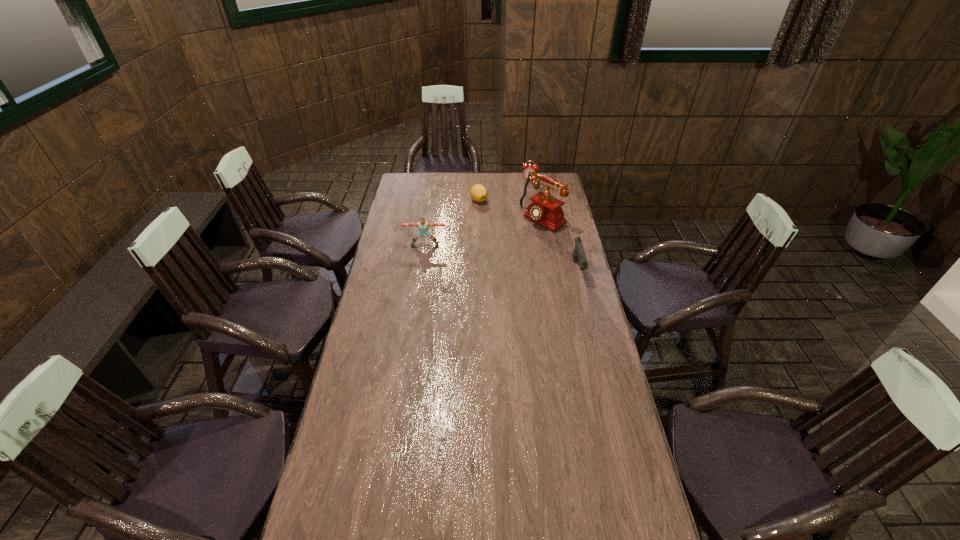
Find the location of a particular element. This screenshot has height=540, width=960. puncher is located at coordinates coord(423,225).

The image size is (960, 540). What are the coordinates of `the leftmost object` in the screenshot? It's located at (423, 225).

Find the location of a particular element. the nearest object is located at coordinates (578, 254).

This screenshot has height=540, width=960. In order to click on lemon in this screenshot , I will do `click(478, 192)`.

You are a GUI agent. You are given a task and a screenshot of the screen. Output one action in this format:
    pyautogui.click(x=<x>, y=<y>)
    Task: Click on the second object from left to right
    Image resolution: width=960 pixels, height=540 pixels.
    Given the screenshot: What is the action you would take?
    click(478, 192)

Where is `the farthest object`? the farthest object is located at coordinates (527, 168).

Where is `the tallest object`? The width and height of the screenshot is (960, 540). the tallest object is located at coordinates (546, 210).

Find the location of `telephone`. telephone is located at coordinates (546, 210).

Locate an element on the screen. free space located on the front-facing side of the leftmost object is located at coordinates (423, 254).

Image resolution: width=960 pixels, height=540 pixels. Identify the location of free space located at the barrel of the nearest object. (593, 333).